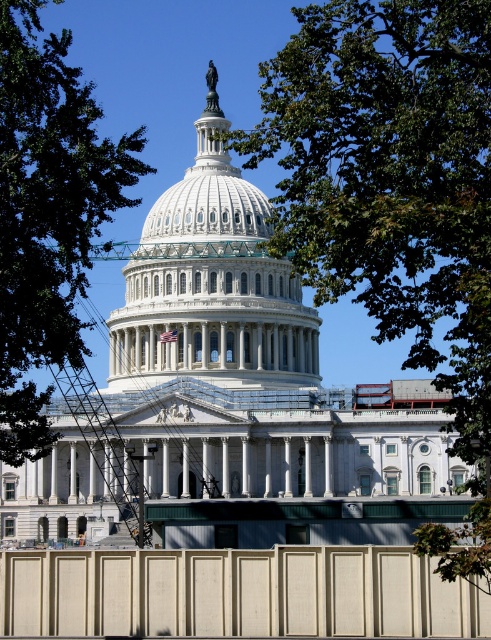
Question: Among these objects, which one is farthest from the camera?

Choices:
 (A) green leafy tree at upper left
 (B) green leafy tree at upper center

Answer: (A)

Question: Can you confirm if green leafy tree at upper center is wider than green leafy tree at upper left?

Choices:
 (A) no
 (B) yes

Answer: (B)

Question: Can you confirm if green leafy tree at upper center is positioned to the left of green leafy tree at upper left?

Choices:
 (A) no
 (B) yes

Answer: (A)

Question: Which point appears farthest from the camera in this image?

Choices:
 (A) (426, 272)
 (B) (80, 275)

Answer: (A)

Question: Does green leafy tree at upper center have a greater width compared to green leafy tree at upper left?

Choices:
 (A) no
 (B) yes

Answer: (B)

Question: Which point appears farthest from the camera in this image?

Choices:
 (A) [311, 24]
 (B) [72, 257]

Answer: (B)